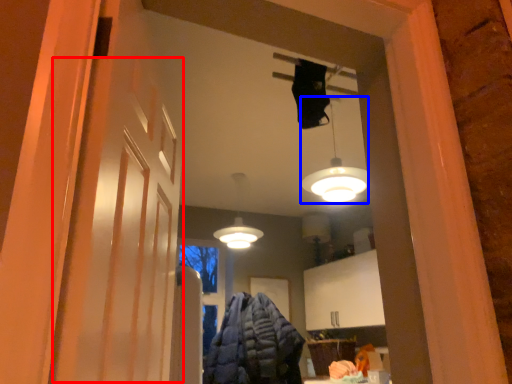
Question: Which point is closer to the camera, barn door (highlighted by a red box) or lamp (highlighted by a blue box)?

Choices:
 (A) barn door
 (B) lamp

Answer: (A)